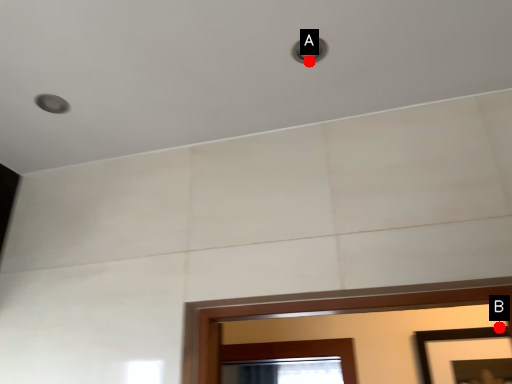
Question: Two points are circled on the image, labeled by A and B beside each circle. Which point appears farthest from the camera in this image?

Choices:
 (A) A is further
 (B) B is further

Answer: (B)